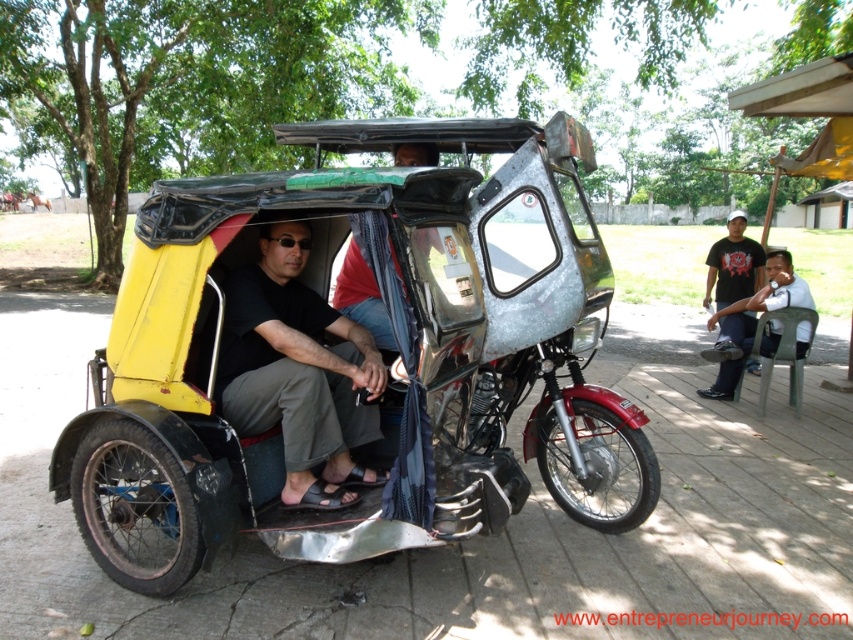
Question: Considering the relative positions of dark gray plastic chair at right and black t-shirt at upper right in the image provided, where is dark gray plastic chair at right located with respect to black t-shirt at upper right?

Choices:
 (A) below
 (B) above

Answer: (A)

Question: Estimate the real-world distances between objects in this image. Which object is farther from the black t-shirt at upper right?

Choices:
 (A) yellow matte tricycle at center
 (B) dark gray plastic chair at right

Answer: (A)

Question: Can you confirm if dark gray plastic chair at right is smaller than black t-shirt at upper right?

Choices:
 (A) yes
 (B) no

Answer: (A)

Question: Considering the real-world distances, which object is farthest from the yellow matte tricycle at center?

Choices:
 (A) dark gray plastic chair at right
 (B) black t-shirt at upper right
 (C) black matte shirt at center

Answer: (B)

Question: Which object is positioned farthest from the black t-shirt at upper right?

Choices:
 (A) dark gray plastic chair at right
 (B) yellow matte tricycle at center

Answer: (B)

Question: Is dark gray plastic chair at right positioned in front of black t-shirt at upper right?

Choices:
 (A) no
 (B) yes

Answer: (B)